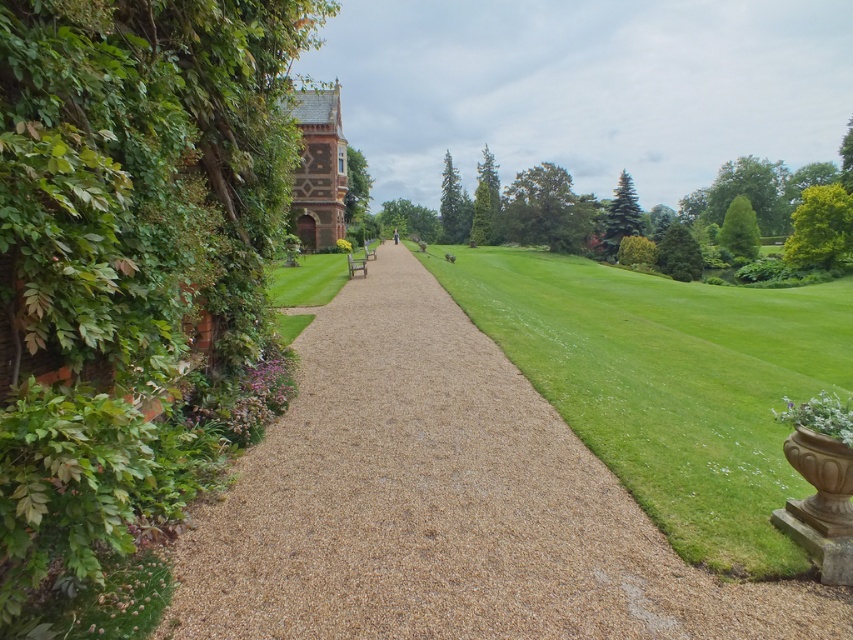
Looking at this image, does green grass at center have a greater width compared to green leafy hedge at right?

Yes.

Who is shorter, green grass at center or green leafy hedge at right?

green grass at center

Identify the location of green grass at center. This screenshot has width=853, height=640. (669, 385).

The image size is (853, 640). Find the location of `green grass at center`. green grass at center is located at coordinates (669, 385).

Is green leafy hedge at left wider than green grass at center?

In fact, green leafy hedge at left might be narrower than green grass at center.

Is green leafy hedge at left positioned behind green grass at center?

No, green leafy hedge at left is closer to the viewer.

Image resolution: width=853 pixels, height=640 pixels. Describe the element at coordinates (126, 252) in the screenshot. I see `green leafy hedge at left` at that location.

Identify the location of green leafy hedge at left. (126, 252).

Which is more to the left, green leafy hedge at left or green leafy hedge at right?

green leafy hedge at left

Can you confirm if green leafy hedge at left is positioned below green leafy hedge at right?

Correct, green leafy hedge at left is located below green leafy hedge at right.

Describe the element at coordinates (126, 252) in the screenshot. The height and width of the screenshot is (640, 853). I see `green leafy hedge at left` at that location.

Where is `green leafy hedge at left`? green leafy hedge at left is located at coordinates (126, 252).